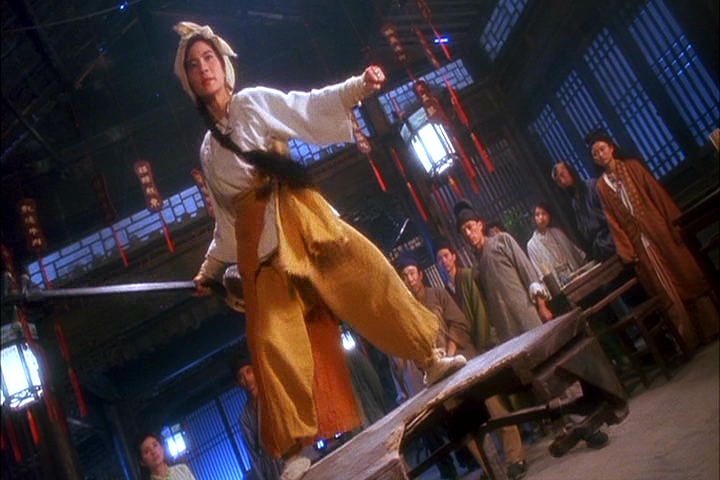
I want to click on exposed rafter in the ceiling space, so [126, 131].